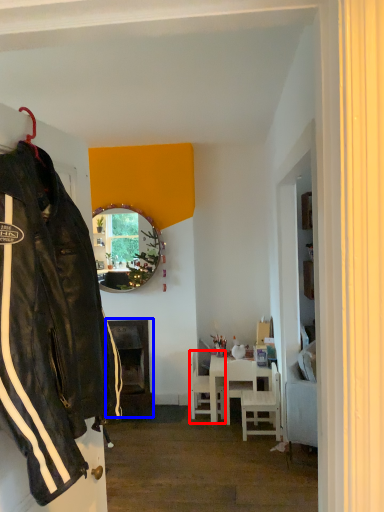
Question: Which object appears closest to the camera in this image, chair (highlighted by a red box) or fireplace (highlighted by a blue box)?

Choices:
 (A) chair
 (B) fireplace

Answer: (A)